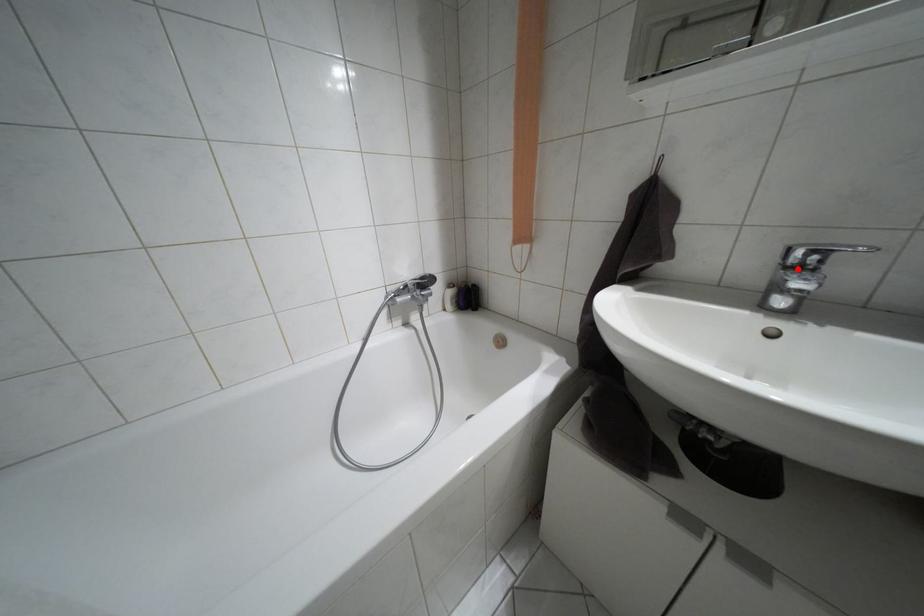
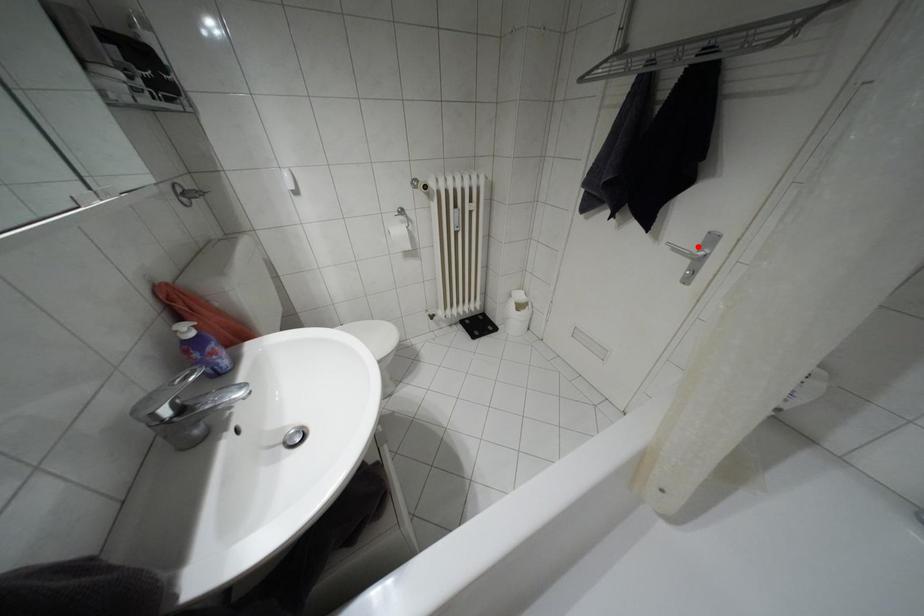
I am providing you with two images of the same scene from different viewpoints. A red point is marked on the first image and another point is marked on the second image. Do the highlighted points in image1 and image2 indicate the same real-world spot?

No